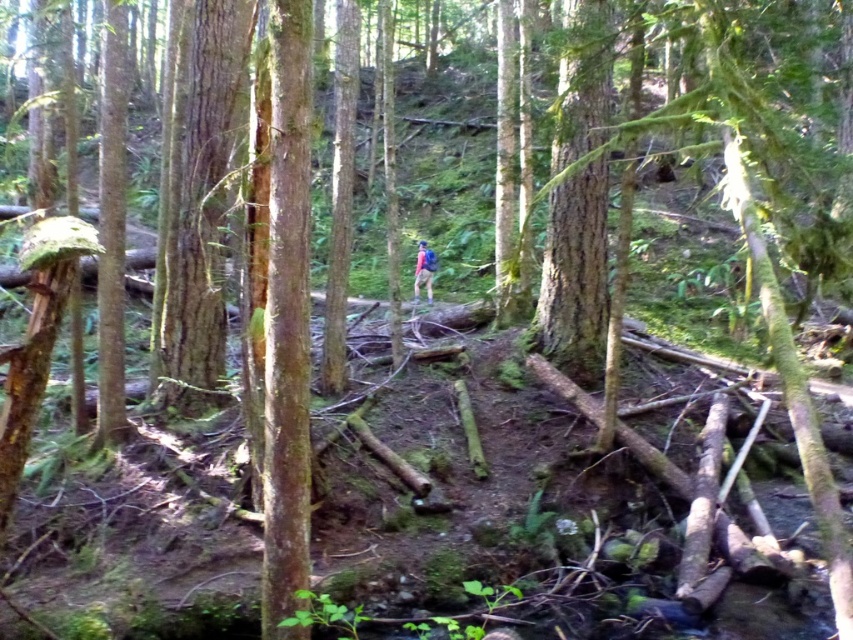
Question: Is smooth brown tree trunk at center bigger than matte pink backpack at center?

Choices:
 (A) yes
 (B) no

Answer: (A)

Question: Which point is closer to the camera?

Choices:
 (A) (281, 243)
 (B) (415, 292)

Answer: (A)

Question: Can you confirm if smooth brown tree trunk at center is positioned to the left of matte pink backpack at center?

Choices:
 (A) yes
 (B) no

Answer: (A)

Question: Can you confirm if smooth brown tree trunk at center is smaller than matte pink backpack at center?

Choices:
 (A) yes
 (B) no

Answer: (B)